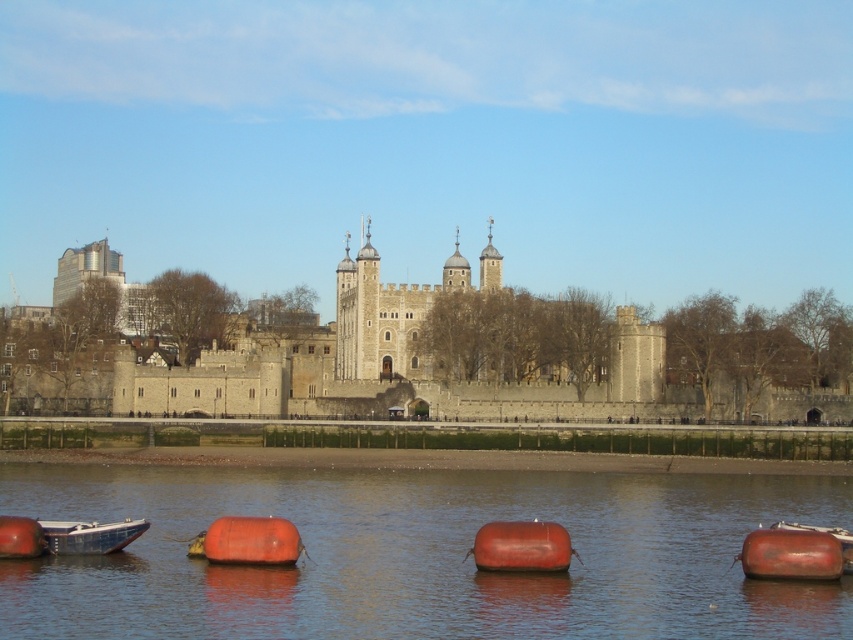
You are a tour guide explaining the castle and the river to visitors. You mention both the stone castle at center and the matte orange buoy at lower right. Which object is wider?

The stone castle at center is wider than the matte orange buoy at lower right, as its width surpasses that of the buoy.

You are a tourist standing on the castle wall looking down at the water. You see the smooth rubber buoys at lower center and the matte orange buoy at lower right. Which buoy is closer to the edge of the water near the castle wall?

The smooth rubber buoys at lower center are closer to the edge of the water near the castle wall because they are positioned below the matte orange buoy at lower right, meaning they are situated closer to the observer standing on the castle wall.